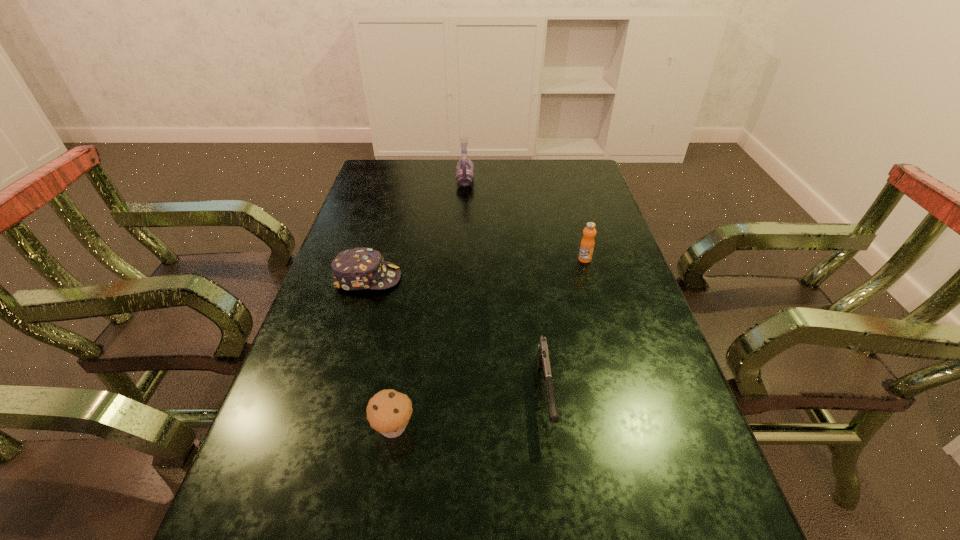
At what (x,y) coordinates should I click in order to perform the action: click on unoccupied position between the gun and the tallest object. Please return your answer as a coordinate pair (x, y). Looking at the image, I should click on (505, 287).

You are a GUI agent. You are given a task and a screenshot of the screen. Output one action in this format:
    pyautogui.click(x=<x>, y=<y>)
    Task: Click on the blank region between the second object from left to right and the gun
    This screenshot has width=960, height=540.
    Given the screenshot: What is the action you would take?
    pyautogui.click(x=469, y=410)

Where is `unoccupied area between the muffin and the leftmost object`? This screenshot has height=540, width=960. unoccupied area between the muffin and the leftmost object is located at coordinates (380, 353).

I want to click on free area in between the farthest object and the leftmost object, so click(417, 230).

The width and height of the screenshot is (960, 540). I want to click on vacant space in between the muffin and the tallest object, so click(x=429, y=303).

At what (x,y) coordinates should I click in order to perform the action: click on vacant area that lies between the second tallest object and the second object from left to right. Please return your answer as a coordinate pair (x, y). The width and height of the screenshot is (960, 540). Looking at the image, I should click on (489, 343).

The height and width of the screenshot is (540, 960). Find the location of `empty space that is in between the fourth object from right to left and the gun`. empty space that is in between the fourth object from right to left and the gun is located at coordinates (469, 410).

Locate an element on the screen. Image resolution: width=960 pixels, height=540 pixels. vacant area that lies between the fourth object from right to left and the second tallest object is located at coordinates (489, 343).

Where is `empty space that is in between the muffin and the gun`? The width and height of the screenshot is (960, 540). empty space that is in between the muffin and the gun is located at coordinates (469, 410).

Where is `vacant point located between the fourth object from right to left and the gun`? This screenshot has width=960, height=540. vacant point located between the fourth object from right to left and the gun is located at coordinates (469, 410).